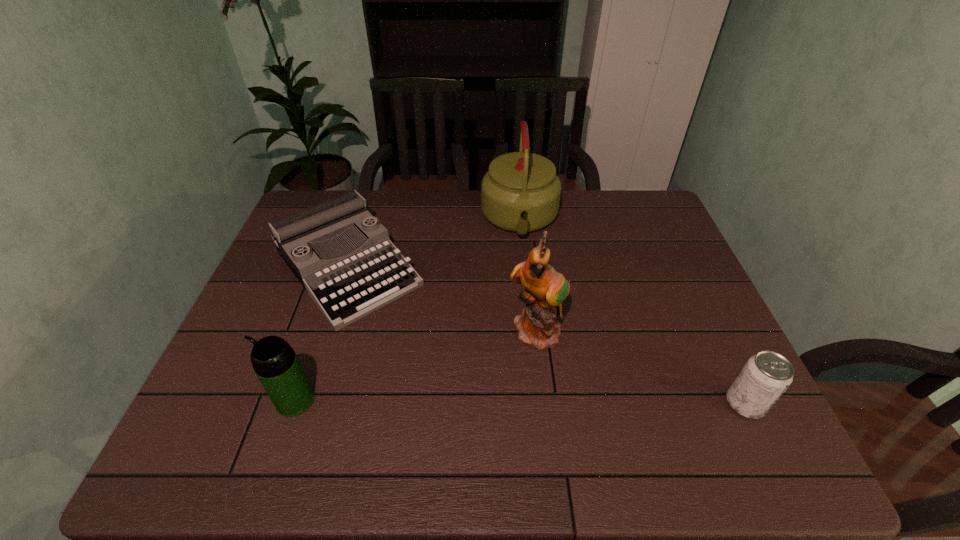
You are a GUI agent. You are given a task and a screenshot of the screen. Output one action in this format:
    pyautogui.click(x=<x>, y=<y>)
    Task: Click on the thermos bottle
    
    Given the screenshot: What is the action you would take?
    pyautogui.click(x=274, y=361)

I want to click on soda can, so click(766, 375).

Locate an element on the screen. The height and width of the screenshot is (540, 960). typewriter is located at coordinates (346, 285).

The height and width of the screenshot is (540, 960). What are the coordinates of `kettle` in the screenshot? It's located at (521, 192).

Where is `parrot`? Image resolution: width=960 pixels, height=540 pixels. parrot is located at coordinates (545, 289).

You are a GUI agent. You are given a task and a screenshot of the screen. Output one action in this format:
    pyautogui.click(x=<x>, y=<y>)
    Task: Click on the vacant space located 0.060m from the spout of the thermos bottle
    Image resolution: width=960 pixels, height=540 pixels.
    Given the screenshot: What is the action you would take?
    pyautogui.click(x=250, y=400)

I want to click on vacant space located 0.130m from the spout of the thermos bottle, so click(218, 400).

Locate an element on the screen. This screenshot has height=540, width=960. free location located on the left of the soda can is located at coordinates (554, 403).

Where is `free space located 0.160m on the typing side of the typewriter`? The image size is (960, 540). free space located 0.160m on the typing side of the typewriter is located at coordinates (421, 355).

Locate an element on the screen. The image size is (960, 540). free spot located on the typing side of the typewriter is located at coordinates (465, 404).